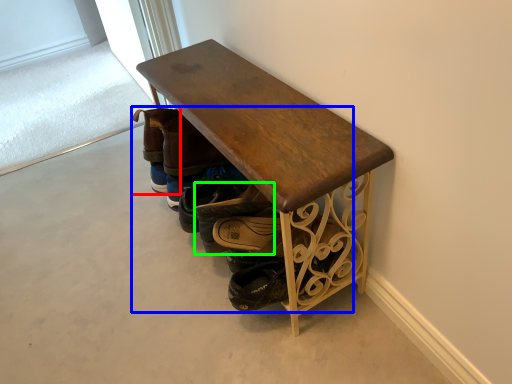
Question: Estimate the real-world distances between objects in this image. Which object is closer to footwear (highlighted by a red box), footwear (highlighted by a blue box) or footwear (highlighted by a green box)?

Choices:
 (A) footwear
 (B) footwear

Answer: (A)